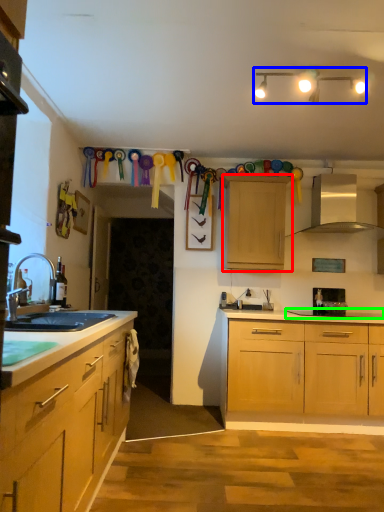
Question: Which object is positioned closest to cabinetry (highlighted by a red box)? Select from lamp (highlighted by a blue box) and gas stove (highlighted by a green box).

Choices:
 (A) lamp
 (B) gas stove

Answer: (B)